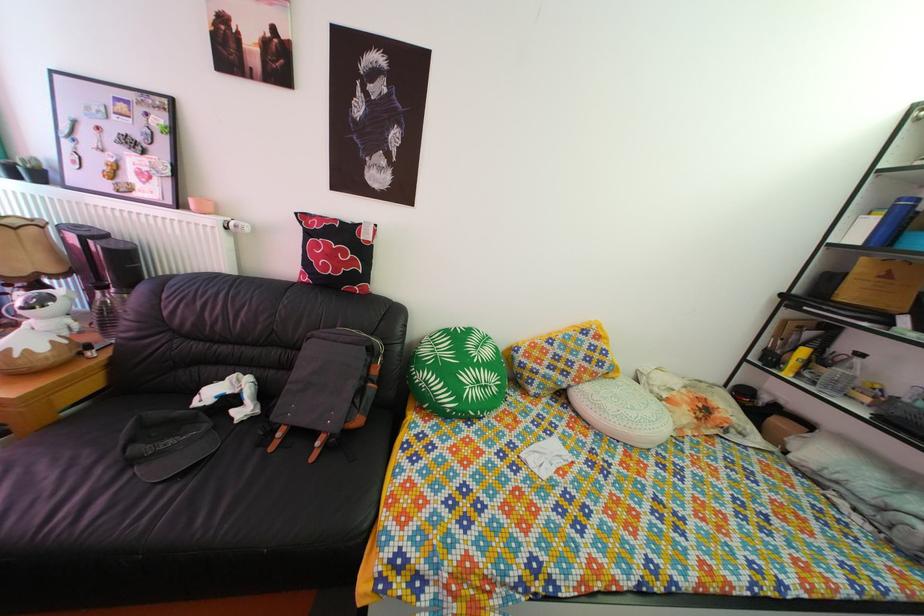
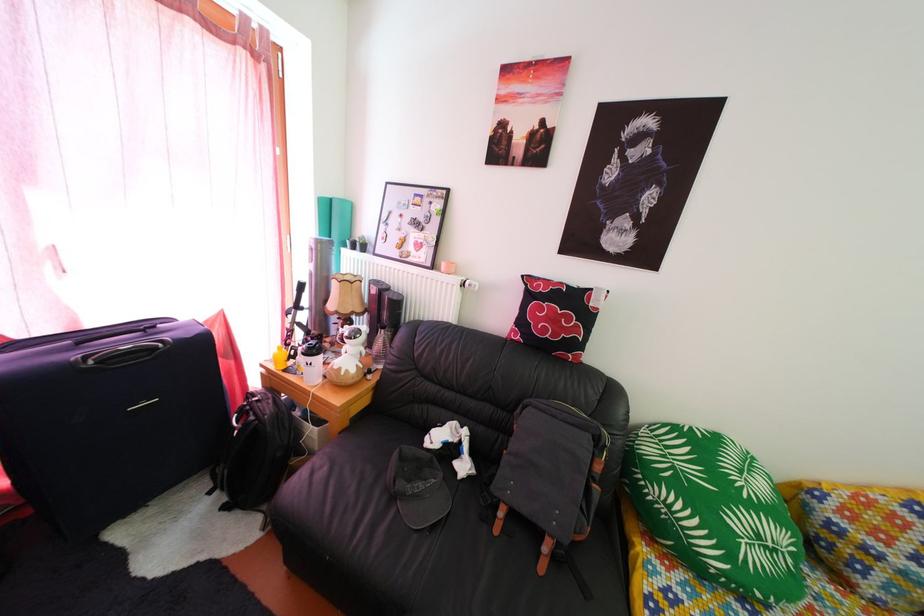
Where in the second image is the point corresponding to [338,264] from the first image?

(562, 328)